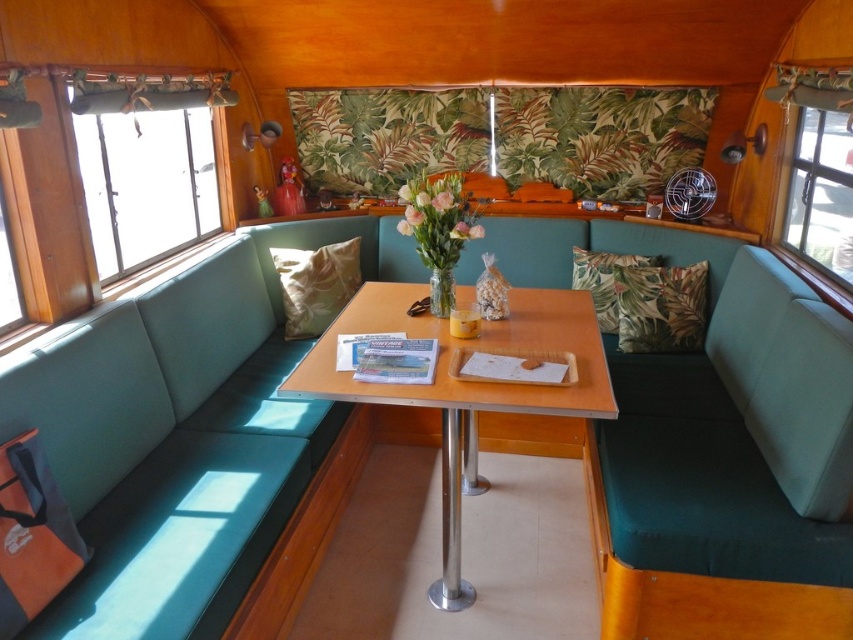
Question: Which point is farther from the camera taking this photo?

Choices:
 (A) (440, 380)
 (B) (190, 460)
 (C) (294, 252)

Answer: (C)

Question: Which of these objects is positioned closest to the teal fabric couch at left?

Choices:
 (A) translucent glass vase at center
 (B) floral fabric pillow at center
 (C) green leafy fabric pillow at center
 (D) green fabric pillow at center

Answer: (D)

Question: Is green leafy fabric pillow at center below clear glass vase at center?

Choices:
 (A) no
 (B) yes

Answer: (B)

Question: Is green leafy fabric pillow at center wider than translucent glass vase at center?

Choices:
 (A) yes
 (B) no

Answer: (A)

Question: Which of the following is the farthest from the observer?

Choices:
 (A) (434, 209)
 (B) (422, 228)
 (C) (618, 328)

Answer: (C)

Question: From the image, what is the correct spatial relationship of translucent glass vase at center in relation to pink matte vase at center?

Choices:
 (A) above
 (B) below

Answer: (A)